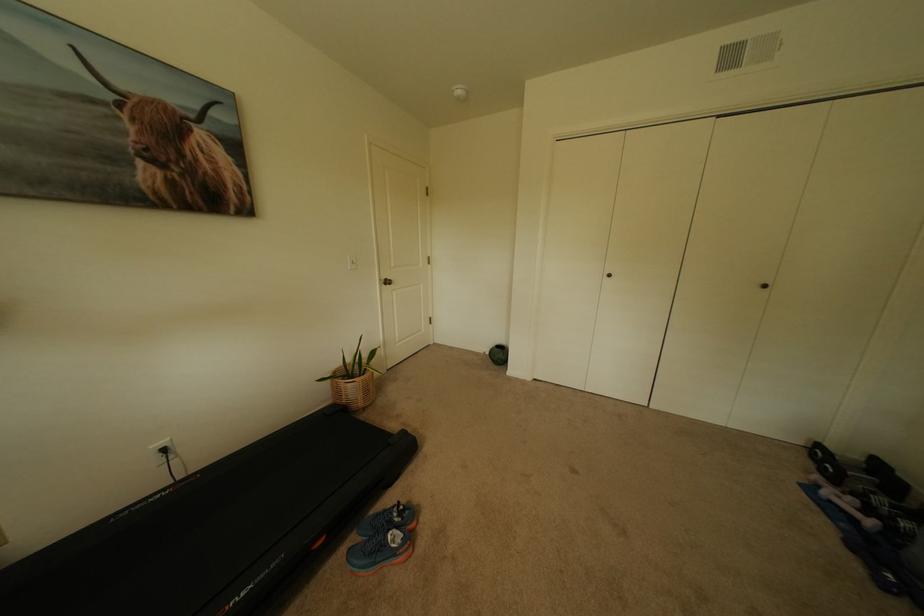
Find the location of a particular element. blue running shoe is located at coordinates (383, 539).